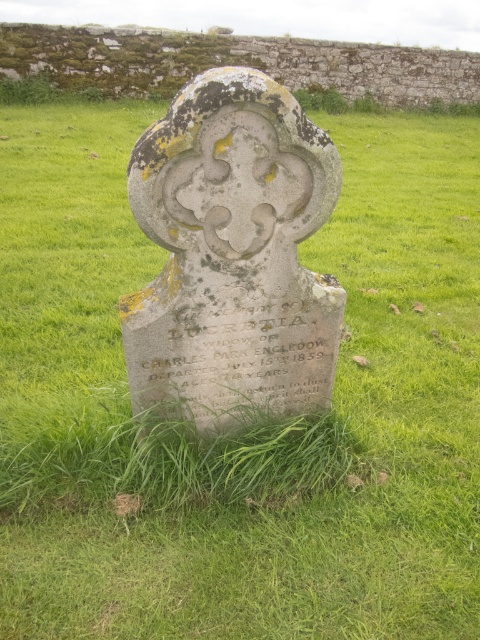
You are a historian examining the gray stone gravestone at center and the smooth gray stone at center in the cemetery. Which object is taller?

The gray stone gravestone at center is taller than the smooth gray stone at center.

From the picture: You are standing in front of the gravestone and notice two points marked on it. Which point, point (230,353) or point (207,38), is closer to you?

Point (230,353) is closer to the viewer than point (207,38).